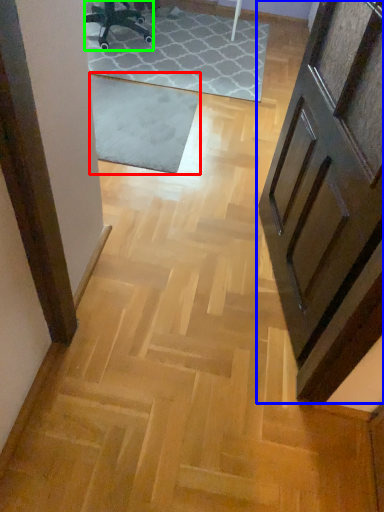
Question: Estimate the real-world distances between objects in this image. Which object is farther from mat (highlighted by a red box), door (highlighted by a blue box) or chair (highlighted by a green box)?

Choices:
 (A) door
 (B) chair

Answer: (A)